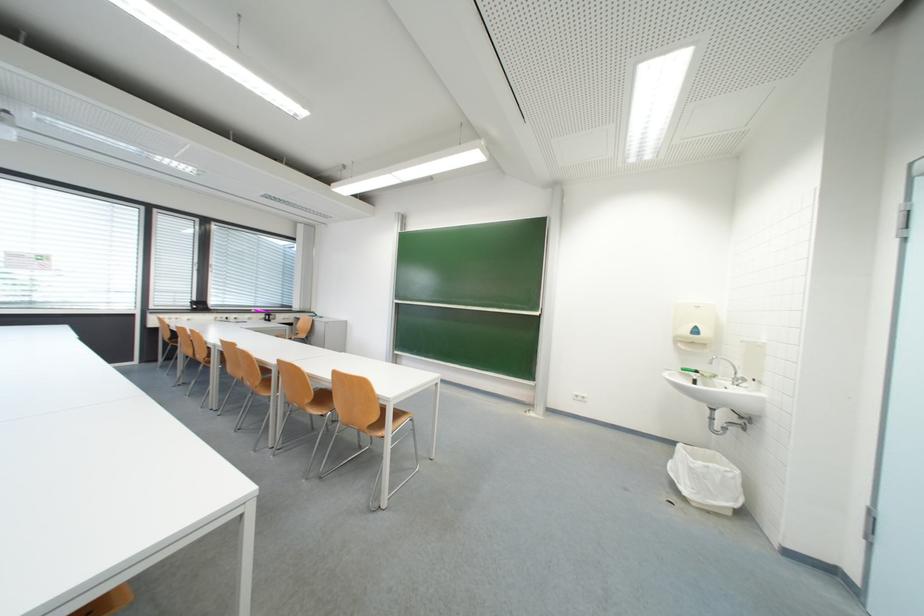
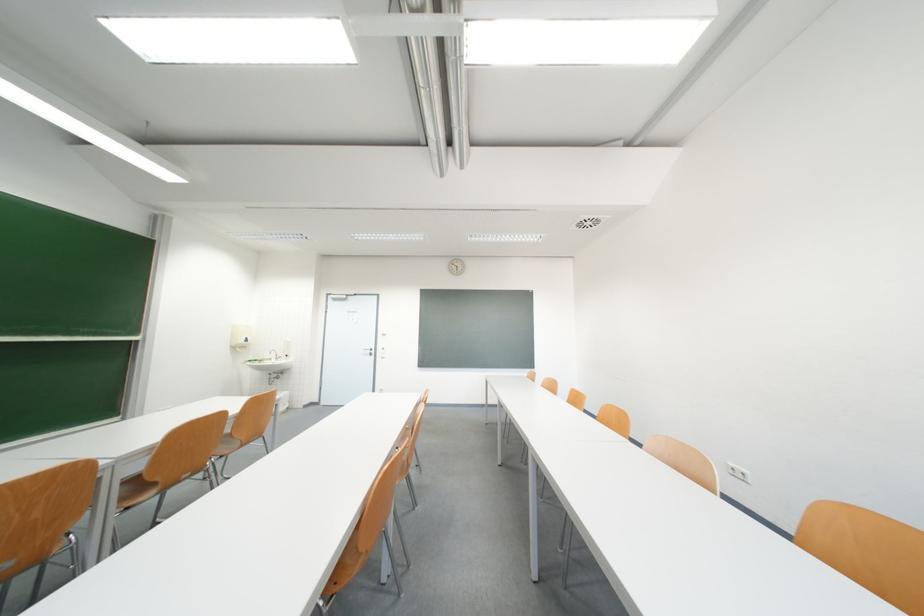
Question: I am providing you with two images of the same scene from different viewpoints. Which of the following objects are not visible in image2?

Choices:
 (A) white power outlet
 (B) sink faucet handle
 (C) green handled screwdriver
 (D) pink water bottle

Answer: (C)